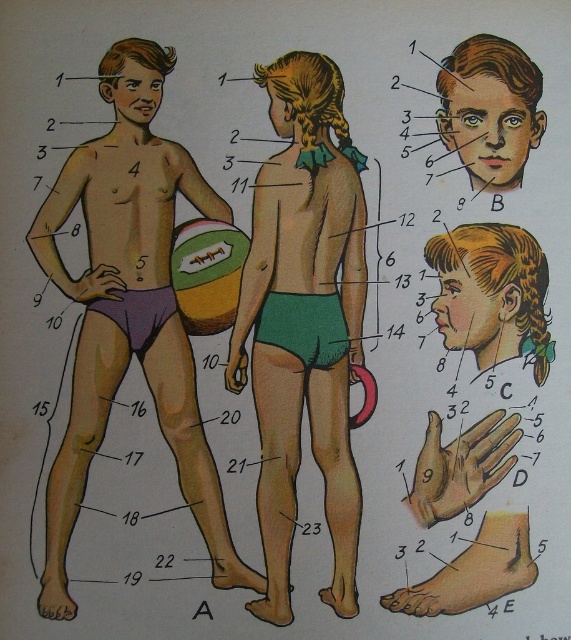
Who is shorter, purple matte shorts at left or smooth skin boy at center?

With less height is smooth skin boy at center.

Does point (172, 58) come closer to viewer compared to point (493, 268)?

That is True.

Who is more forward, (119,157) or (486,516)?

Point (119,157)

Locate an element on the screen. The height and width of the screenshot is (640, 571). purple matte shorts at left is located at coordinates (110, 266).

Is green matte shorts at center to the left of purple matte shorts at left from the viewer's perspective?

No, green matte shorts at center is not to the left of purple matte shorts at left.

Who is shorter, green matte shorts at center or purple matte shorts at left?

Standing shorter between the two is green matte shorts at center.

Between point (271, 74) and point (142, 188), which one is positioned behind?

Positioned behind is point (271, 74).

This screenshot has width=571, height=640. I want to click on green matte shorts at center, so click(303, 321).

Which is more to the right, green rubber beach ball at lower center or purple matte underwear at lower left?

green rubber beach ball at lower center

Is point (190, 285) in front of point (104, 312)?

No, it is not.

Is point (192, 227) closer to viewer compared to point (159, 317)?

No, it is not.

Where is `green rubber beach ball at lower center`? The height and width of the screenshot is (640, 571). green rubber beach ball at lower center is located at coordinates (207, 273).